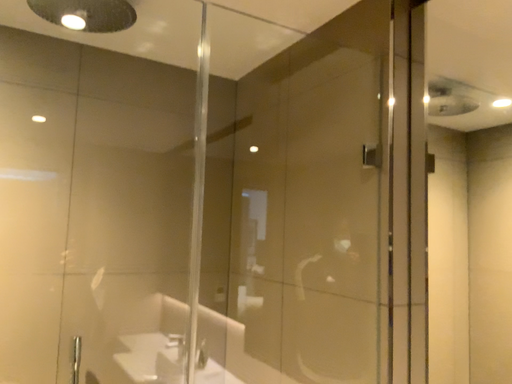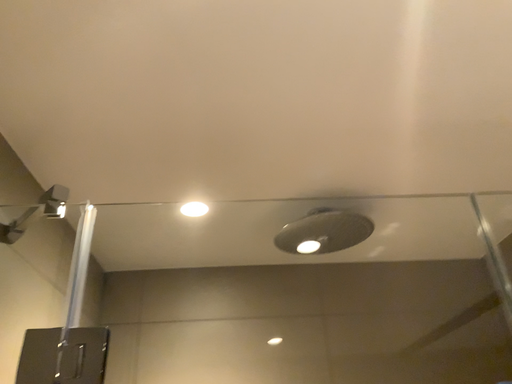
Question: How did the camera likely rotate when shooting the video?

Choices:
 (A) rotated left
 (B) rotated right

Answer: (A)